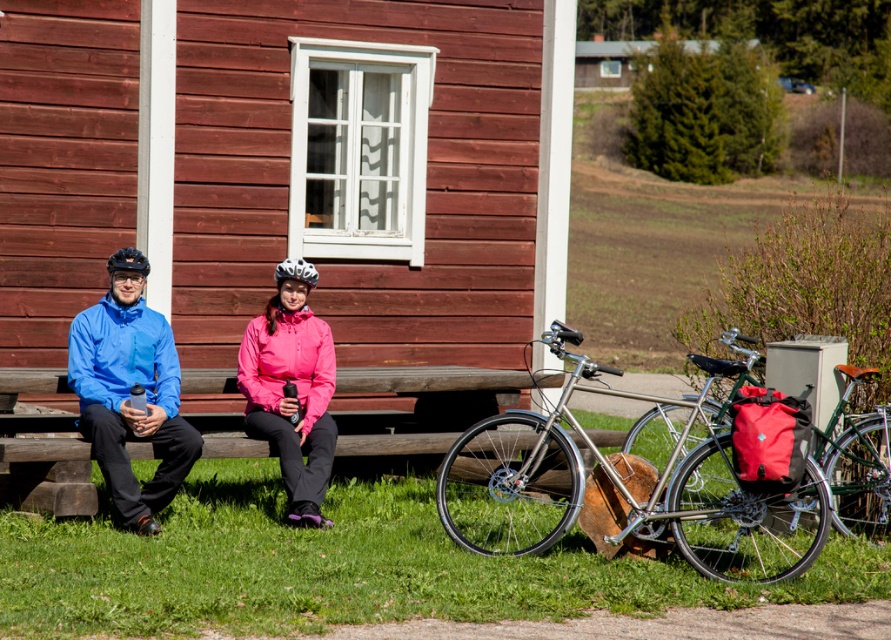
Question: Is matte blue jacket at center smaller than wooden bench at center?

Choices:
 (A) yes
 (B) no

Answer: (B)

Question: Does blue waterproof jacket at left appear under wooden bench at center?

Choices:
 (A) yes
 (B) no

Answer: (B)

Question: Does wooden bench at center appear on the left side of pink matte jacket at center?

Choices:
 (A) yes
 (B) no

Answer: (B)

Question: Which point is closer to the camera?

Choices:
 (A) (544, 548)
 (B) (295, 435)
 (C) (15, 428)

Answer: (A)

Question: Among these objects, which one is farthest from the camera?

Choices:
 (A) wooden bench at center
 (B) matte black bicycle at right

Answer: (A)

Question: Which of the following is the closest to the observer?

Choices:
 (A) wooden bench at center
 (B) silver metallic bicycle at lower right
 (C) blue waterproof jacket at left
 (D) pink matte jacket at center

Answer: (B)